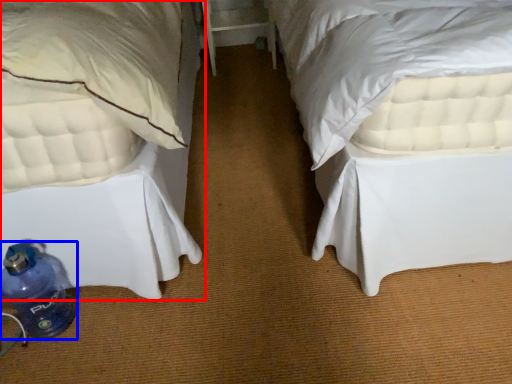
Question: Which object is closer to the camera taking this photo, bed (highlighted by a red box) or bottle (highlighted by a blue box)?

Choices:
 (A) bed
 (B) bottle

Answer: (A)